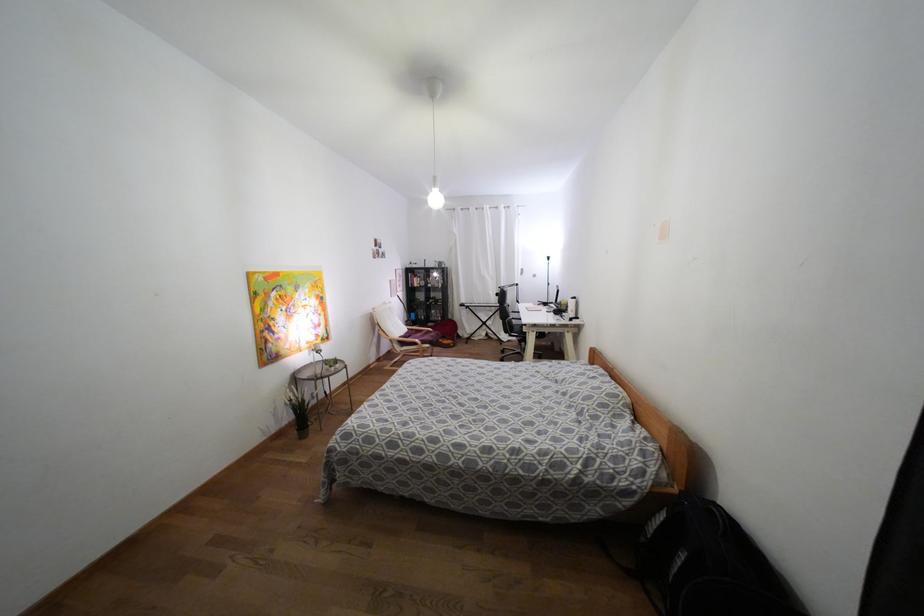
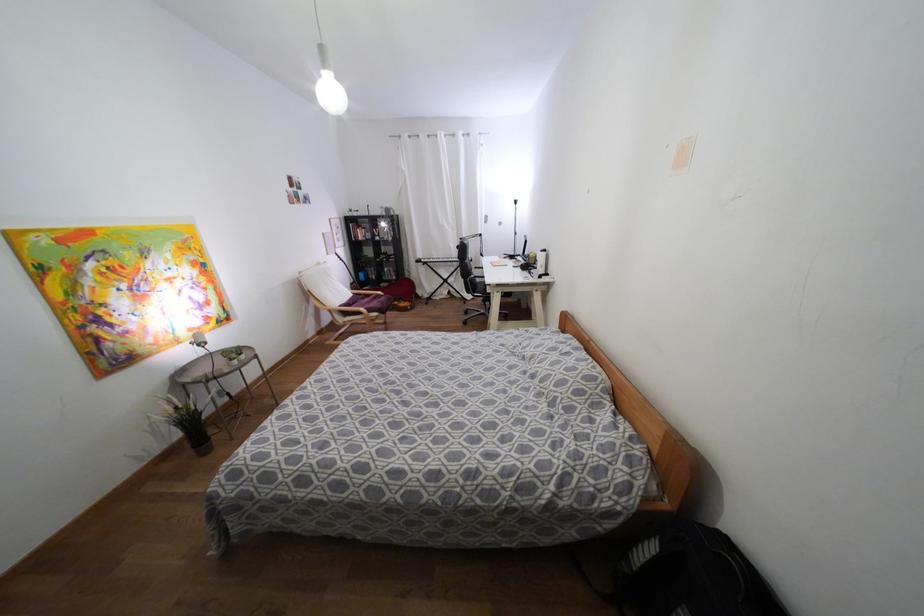
Where in the second image is the point corresponding to point 402,342 from the first image?

(344, 313)